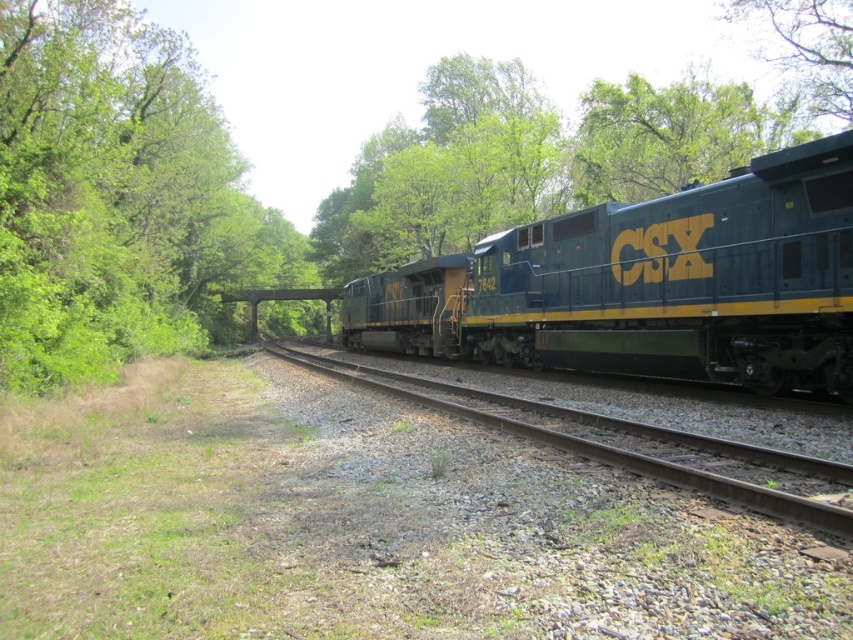
Question: Can you confirm if green metallic track at center is wider than green leafy tree at upper right?

Choices:
 (A) yes
 (B) no

Answer: (B)

Question: Which object is closer to the camera taking this photo?

Choices:
 (A) green leafy tree at upper right
 (B) green metallic track at center
 (C) green matte train at center

Answer: (B)

Question: Which point is farther to the camera?

Choices:
 (A) (833, 250)
 (B) (824, 58)

Answer: (B)

Question: Which is farther from the green metallic track at center?

Choices:
 (A) green leafy tree at upper right
 (B) green matte train at center

Answer: (A)

Question: Is green matte train at center above green leafy tree at upper right?

Choices:
 (A) no
 (B) yes

Answer: (A)

Question: Is green matte train at center bigger than green metallic track at center?

Choices:
 (A) yes
 (B) no

Answer: (A)